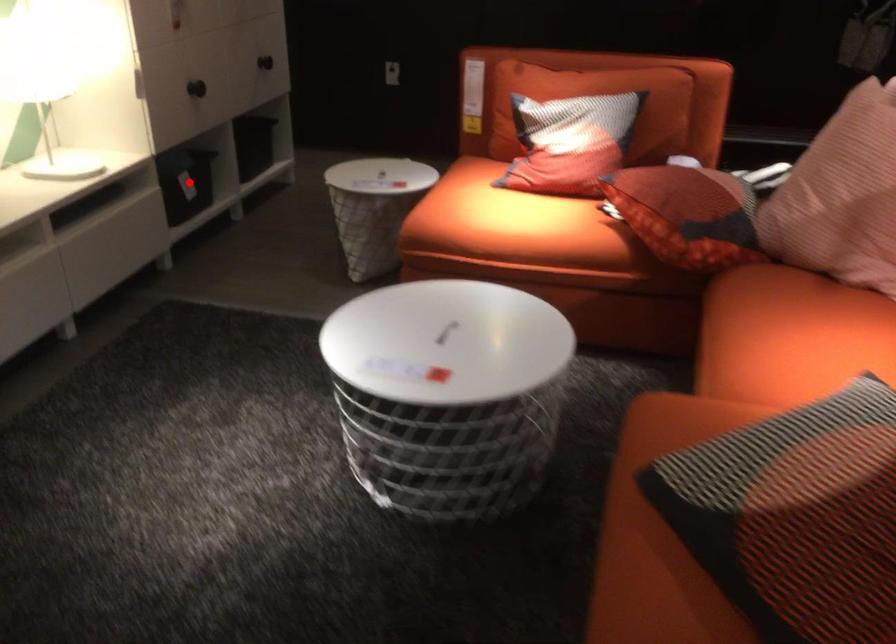
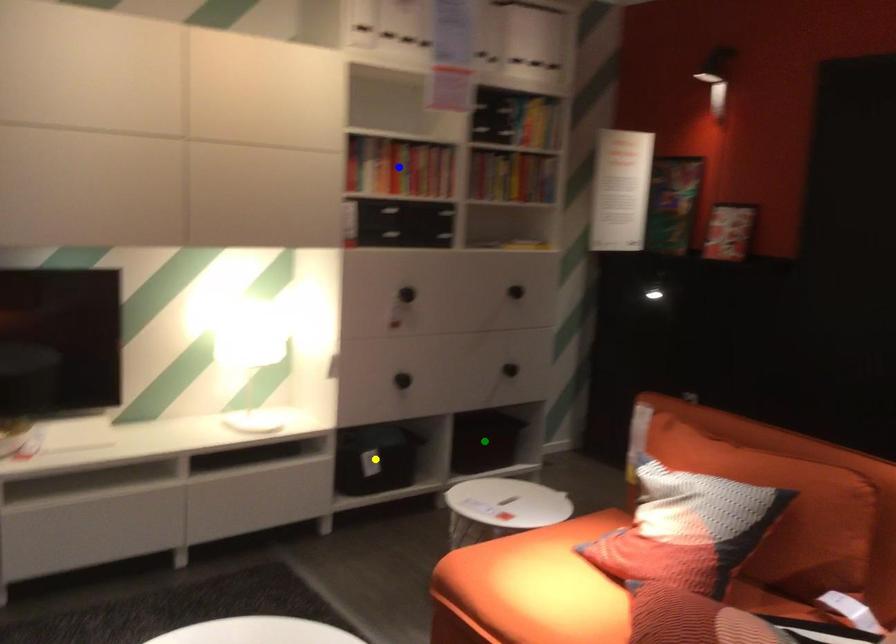
Question: I am providing you with two images of the same scene from different viewpoints. A red point is marked on the first image. You are given multiple points on the second image. In image 2, which mark is for the same physical point as the one in image 1?

Choices:
 (A) yellow point
 (B) green point
 (C) blue point

Answer: (A)